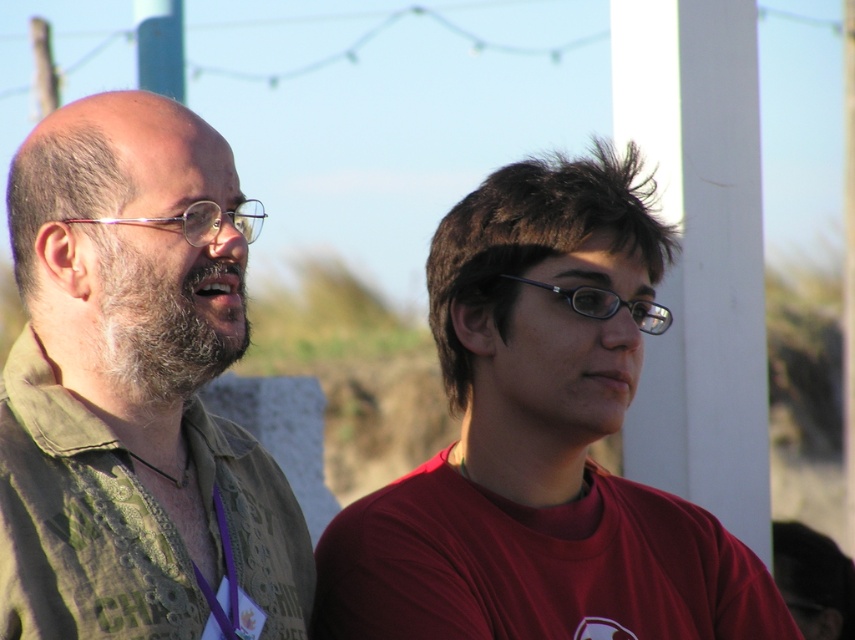
Question: From the image, what is the correct spatial relationship of matte red shirt at center in relation to beardfluffy/softman's face at left?

Choices:
 (A) right
 (B) left

Answer: (A)

Question: Is green textured shirt at left positioned behind beardfluffy/softman's face at left?

Choices:
 (A) no
 (B) yes

Answer: (A)

Question: Which point is farther from the camera taking this photo?

Choices:
 (A) (109, 349)
 (B) (582, 216)

Answer: (B)

Question: Is matte red shirt at center to the right of green textured shirt at left from the viewer's perspective?

Choices:
 (A) yes
 (B) no

Answer: (A)

Question: Considering the real-world distances, which object is farthest from the green textured shirt at left?

Choices:
 (A) beardfluffy/softman's face at left
 (B) matte red shirt at center

Answer: (B)

Question: Which point is closer to the camera taking this photo?

Choices:
 (A) (40, 497)
 (B) (753, 595)

Answer: (A)